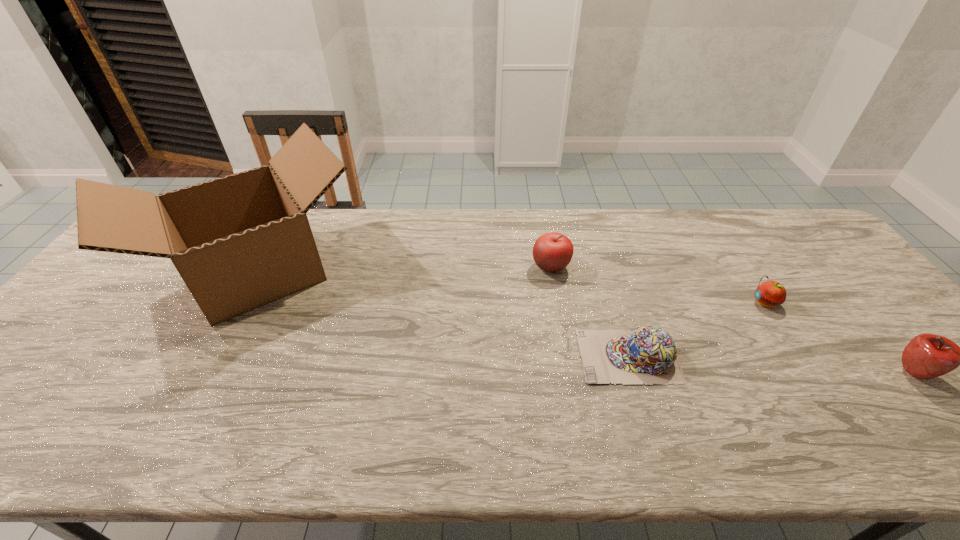
The height and width of the screenshot is (540, 960). In order to click on vacant space situated on the back of the rightmost apple in this screenshot , I will do `click(874, 326)`.

Where is `vacant space located 0.290m on the back of the second apple from left to right`? vacant space located 0.290m on the back of the second apple from left to right is located at coordinates (717, 230).

The height and width of the screenshot is (540, 960). I want to click on vacant space located on the front, side, and top of the cap, so click(456, 356).

I want to click on vacant region located 0.180m on the front, side, and top of the cap, so click(x=506, y=356).

I want to click on free space located on the front, side, and top of the cap, so click(x=431, y=356).

You are a GUI agent. You are given a task and a screenshot of the screen. Output one action in this format:
    pyautogui.click(x=<x>, y=<y>)
    Task: Click on the object present at the far edge
    The height and width of the screenshot is (540, 960).
    Given the screenshot: What is the action you would take?
    pyautogui.click(x=239, y=242)

This screenshot has height=540, width=960. Identify the location of object positioned at the left edge. (239, 242).

The image size is (960, 540). I want to click on object present at the right edge, so click(926, 356).

What are the coordinates of `object at the far left corner` in the screenshot? It's located at (239, 242).

Where is `vacant point at the far edge`? The height and width of the screenshot is (540, 960). vacant point at the far edge is located at coordinates (344, 251).